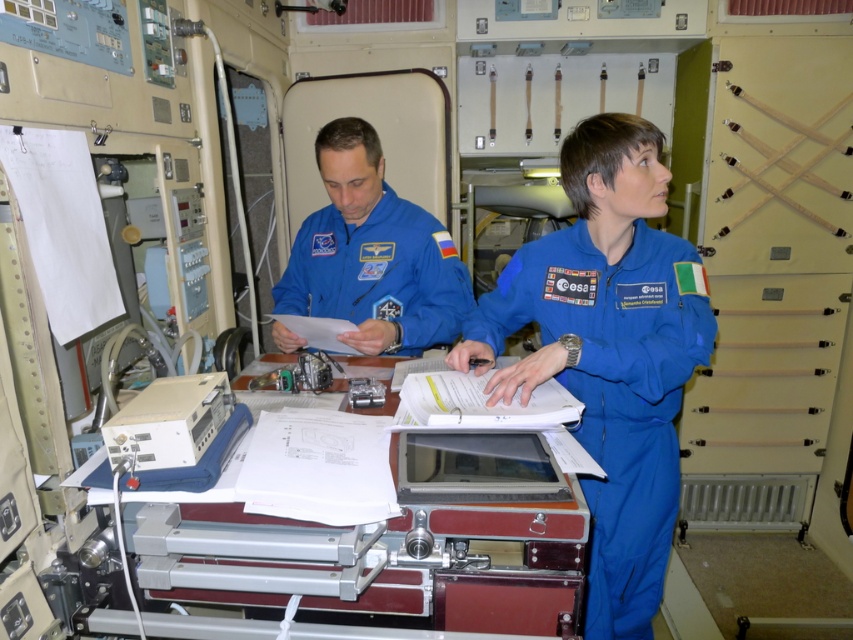
Question: Among these points, which one is nearest to the camera?

Choices:
 (A) (583, 294)
 (B) (473, 611)
 (C) (310, 220)

Answer: (B)

Question: Does blue smooth jumpsuit at center have a larger size compared to metallic silver printer at center?

Choices:
 (A) no
 (B) yes

Answer: (B)

Question: Which is farther from the metallic silver printer at center?

Choices:
 (A) blue fabric astronaut suit at center
 (B) blue smooth jumpsuit at center

Answer: (A)

Question: Can you confirm if metallic silver printer at center is wider than blue fabric astronaut suit at center?

Choices:
 (A) yes
 (B) no

Answer: (A)

Question: Is metallic silver printer at center below blue fabric astronaut suit at center?

Choices:
 (A) yes
 (B) no

Answer: (A)

Question: Estimate the real-world distances between objects in this image. Which object is farther from the metallic silver printer at center?

Choices:
 (A) blue smooth jumpsuit at center
 (B) blue fabric astronaut suit at center

Answer: (B)